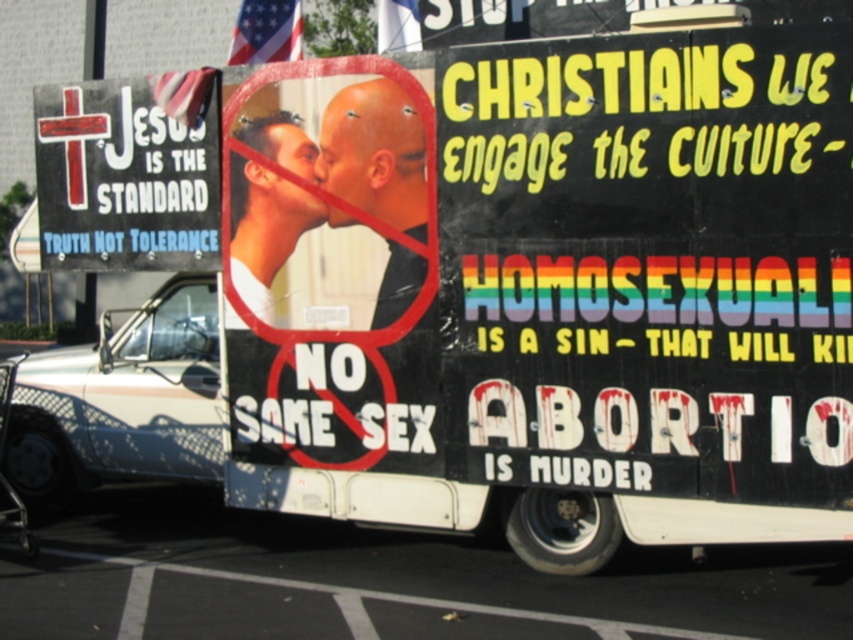
In the scene shown: You are a delivery driver who needs to attach a new sign to the vehicle. The new sign is 1.5 meters long and must be placed between the black painted signboard at center right and the sign with a red cross on the left side. Is there enough space to fit the new sign without overlapping any existing signs?

The distance between the black painted signboard at center right and the sign with a red cross on the left side is 5.45 meters. Since the new sign is only 1.5 meters long, there is sufficient space to place it between them without overlapping existing signs.

You are a photographer trying to capture a clear image of both the black painted signboard at center right and the matte white shirt at center. Based on their positions, which object should you focus on first to ensure both are in focus?

The black painted signboard at center right is in front of the matte white shirt at center, so you should focus on the matte white shirt at center first to ensure both are in focus.